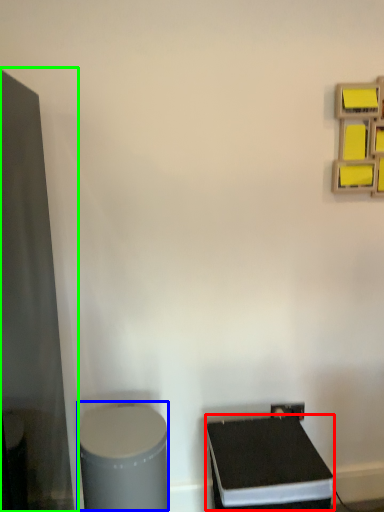
Question: Considering the real-world distances, which object is farthest from wide (highlighted by a red box)? wide (highlighted by a blue box) or glass door (highlighted by a green box)?

Choices:
 (A) wide
 (B) glass door

Answer: (B)